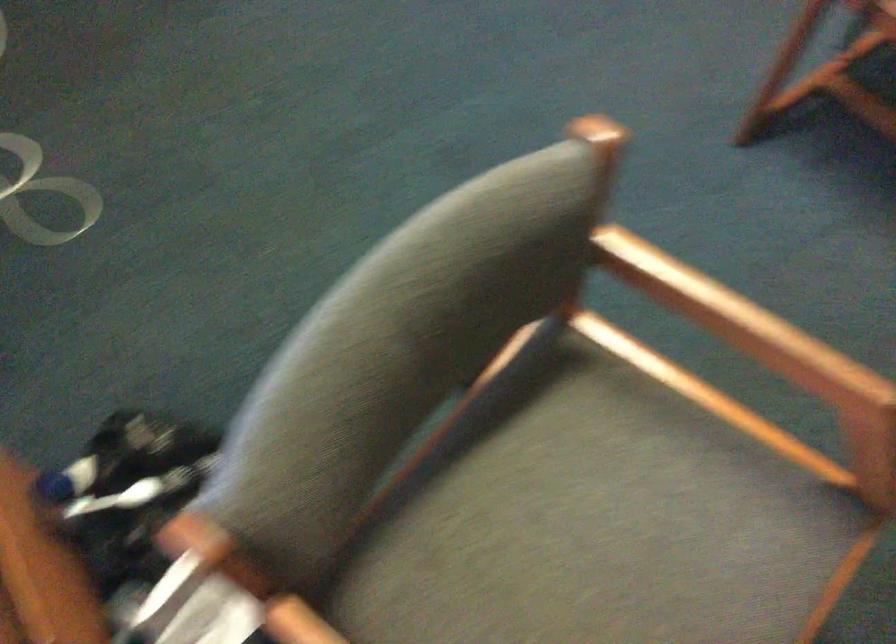
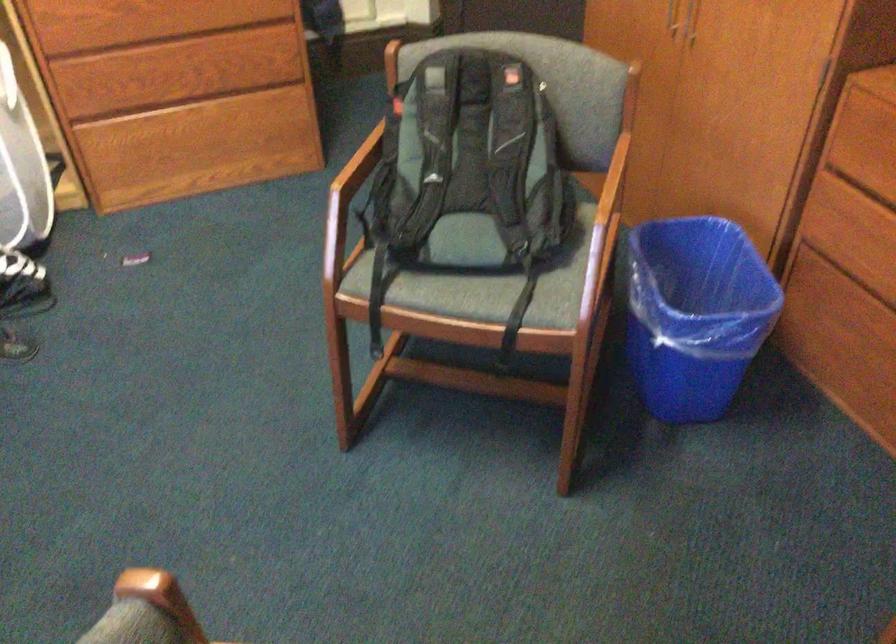
The images are taken continuously from a first-person perspective. In which direction is your viewpoint rotating?

The camera rotated toward right-up.